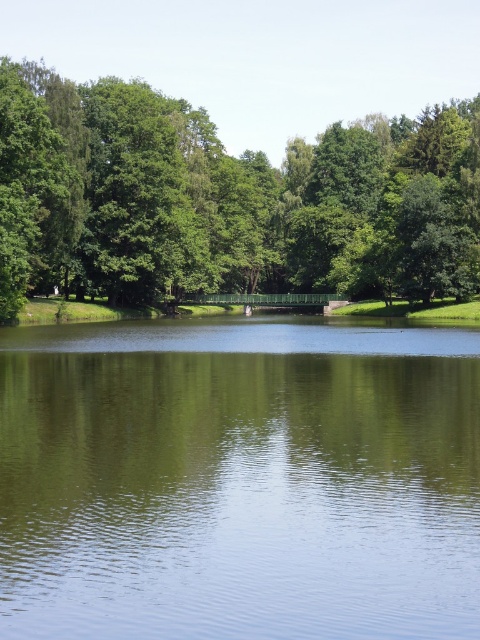
Can you confirm if green reflective water at center is wider than green leafy tree at upper left?

In fact, green reflective water at center might be narrower than green leafy tree at upper left.

Who is shorter, green reflective water at center or green leafy tree at upper left?

green reflective water at center

Which is in front, point (477, 371) or point (19, 180)?

Positioned in front is point (477, 371).

I want to click on green reflective water at center, so click(x=240, y=481).